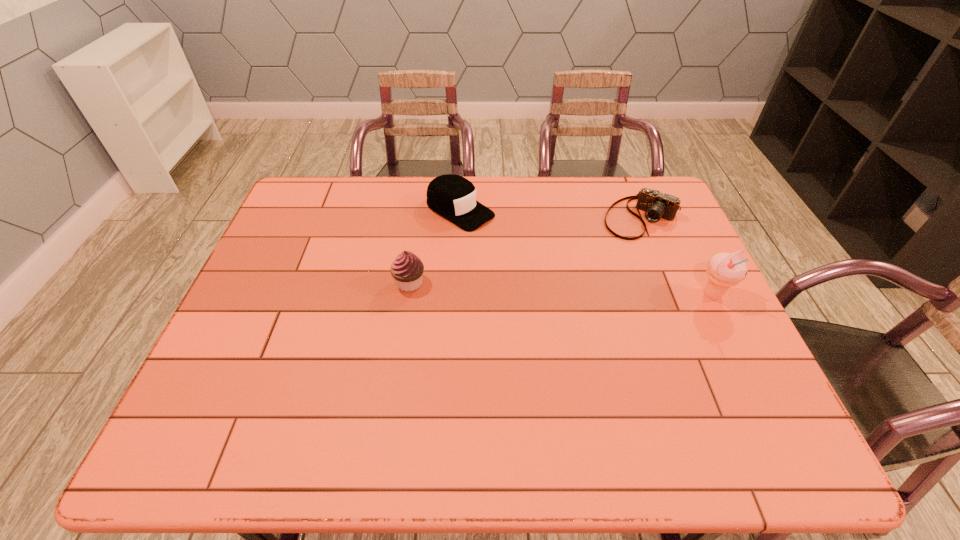
This screenshot has width=960, height=540. What are the coordinates of `free spot on the desktop that is between the third shortest object and the tallest object and is positioned on the front-facing side of the shortest object` in the screenshot? It's located at (586, 290).

Where is `vacant spot on the desktop that is between the cupcake and the tallest object and is positioned on the front-facing side of the third tallest object`? The height and width of the screenshot is (540, 960). vacant spot on the desktop that is between the cupcake and the tallest object and is positioned on the front-facing side of the third tallest object is located at coordinates (593, 290).